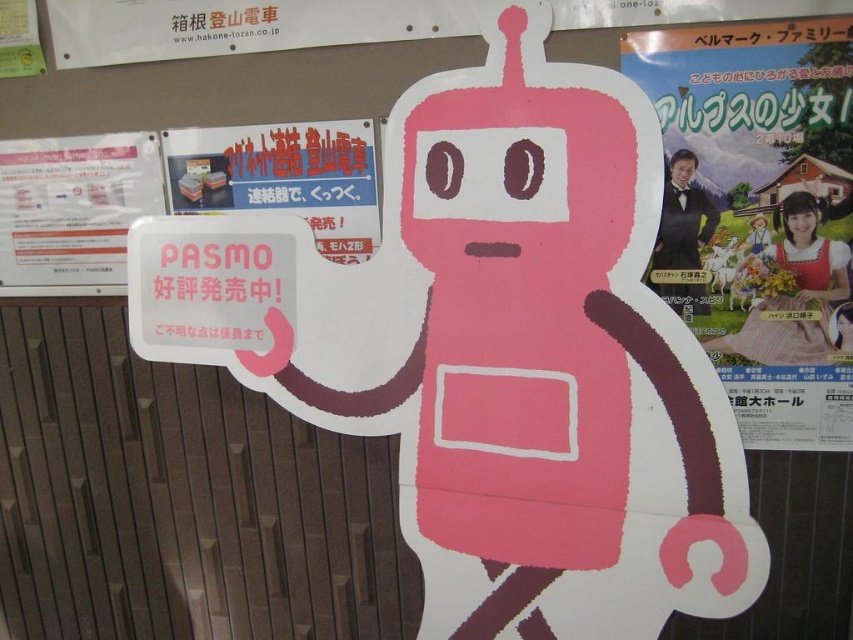
Question: Which point appears farthest from the camera in this image?

Choices:
 (A) (53, 280)
 (B) (801, 316)
 (C) (355, 124)

Answer: (A)

Question: Does matte paper sign at upper left lie in front of matte plastic sign at upper center?

Choices:
 (A) yes
 (B) no

Answer: (B)

Question: Which object is closer to the camera taking this photo?

Choices:
 (A) matte paper sign at upper left
 (B) matte paper poster at right
 (C) matte plastic sign at upper center

Answer: (B)

Question: Which is farther from the matte paper poster at right?

Choices:
 (A) matte paper sign at upper left
 (B) matte plastic sign at upper center

Answer: (A)

Question: Can you confirm if matte paper poster at right is wider than matte plastic sign at upper center?

Choices:
 (A) yes
 (B) no

Answer: (A)

Question: Is matte paper poster at right smaller than matte plastic sign at upper center?

Choices:
 (A) no
 (B) yes

Answer: (A)